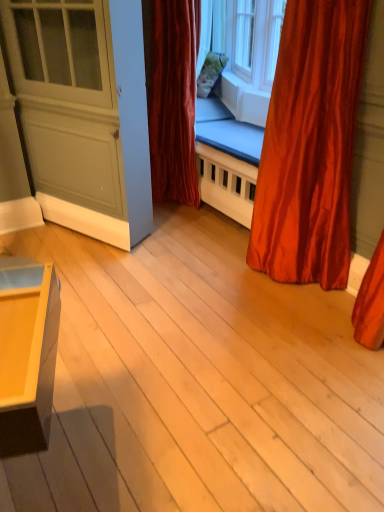
Question: From the image's perspective, is clear glass window at upper center on top of satin red curtain at right, positioned as the first curtain in right-to-left order?

Choices:
 (A) yes
 (B) no

Answer: (A)

Question: From a real-world perspective, does clear glass window at upper center sit lower than satin red curtain at right, the second curtain from the left?

Choices:
 (A) no
 (B) yes

Answer: (A)

Question: Is clear glass window at upper center to the right of satin red curtain at right, positioned as the first curtain in right-to-left order, from the viewer's perspective?

Choices:
 (A) no
 (B) yes

Answer: (A)

Question: Can you confirm if clear glass window at upper center is smaller than satin red curtain at right, the second curtain from the left?

Choices:
 (A) yes
 (B) no

Answer: (A)

Question: From the image's perspective, is clear glass window at upper center beneath satin red curtain at right, the second curtain viewed from the back?

Choices:
 (A) yes
 (B) no

Answer: (B)

Question: Looking at their shapes, would you say velvet red curtain at center, which is the 1th curtain in left-to-right order, is wider or thinner than matte gray screen door at left?

Choices:
 (A) wide
 (B) thin

Answer: (A)

Question: From a real-world perspective, is velvet red curtain at center, which is the 2th curtain from front to back, positioned above or below matte gray screen door at left?

Choices:
 (A) below
 (B) above

Answer: (A)

Question: Do you think velvet red curtain at center, the 1th curtain when ordered from back to front, is within matte gray screen door at left, or outside of it?

Choices:
 (A) inside
 (B) outside

Answer: (B)

Question: Considering the positions of velvet red curtain at center, which is the 1th curtain in left-to-right order, and matte gray screen door at left in the image, is velvet red curtain at center, which is the 1th curtain in left-to-right order, taller or shorter than matte gray screen door at left?

Choices:
 (A) short
 (B) tall

Answer: (B)

Question: Relative to satin red curtain at right, marked as the 1th curtain in a front-to-back arrangement, is velvet red curtain at center, the 1th curtain when ordered from back to front, in front or behind?

Choices:
 (A) front
 (B) behind

Answer: (B)

Question: Considering the positions of point (165, 101) and point (301, 144), is point (165, 101) closer or farther from the camera than point (301, 144)?

Choices:
 (A) farther
 (B) closer

Answer: (A)

Question: In terms of height, does velvet red curtain at center, which is the 2th curtain from front to back, look taller or shorter compared to satin red curtain at right, marked as the 1th curtain in a front-to-back arrangement?

Choices:
 (A) short
 (B) tall

Answer: (B)

Question: Is velvet red curtain at center, which is the 1th curtain in left-to-right order, inside or outside of satin red curtain at right, positioned as the first curtain in right-to-left order?

Choices:
 (A) inside
 (B) outside

Answer: (B)

Question: From the image's perspective, relative to clear glass window at upper center, is velvet red curtain at center, which is the 2th curtain from front to back, above or below?

Choices:
 (A) below
 (B) above

Answer: (A)

Question: In terms of size, does velvet red curtain at center, which is the 2th curtain from front to back, appear bigger or smaller than clear glass window at upper center?

Choices:
 (A) small
 (B) big

Answer: (B)